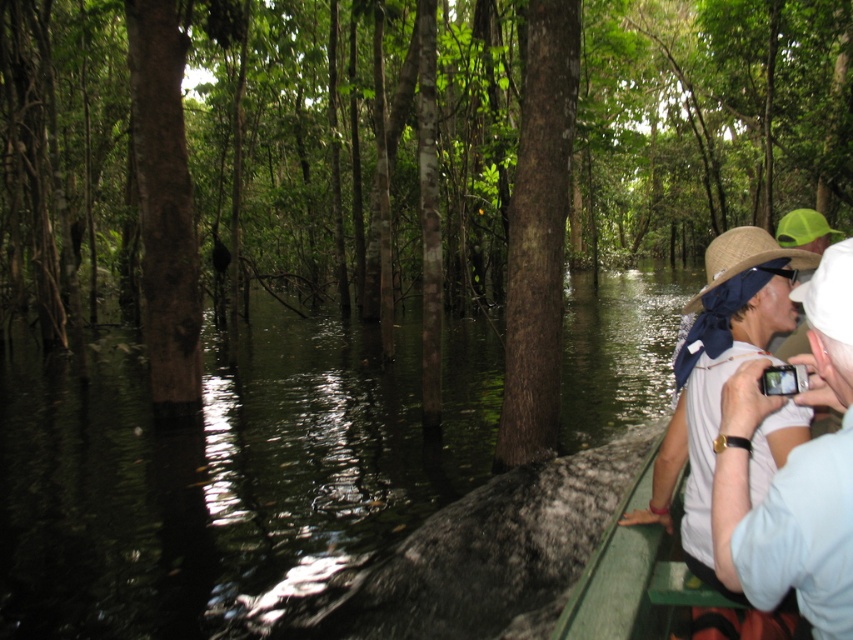
Between light brown straw hat at right and white cotton shirt at right, which one is positioned lower?

Positioned lower is light brown straw hat at right.

Does light brown straw hat at right lie in front of white cotton shirt at right?

Yes, it is in front of white cotton shirt at right.

What do you see at coordinates (793, 472) in the screenshot? I see `light brown straw hat at right` at bounding box center [793, 472].

The image size is (853, 640). What are the coordinates of `light brown straw hat at right` in the screenshot? It's located at (793, 472).

Does brown rough tree at center have a greater width compared to white cotton shirt at right?

Correct, the width of brown rough tree at center exceeds that of white cotton shirt at right.

Is point (498, 81) positioned behind point (699, 538)?

Yes, it is behind point (699, 538).

The width and height of the screenshot is (853, 640). Find the location of `brown rough tree at center`. brown rough tree at center is located at coordinates (402, 157).

Is point (639, 154) positioned behind point (813, 611)?

Yes, point (639, 154) is behind point (813, 611).

Is brown rough tree at center bigger than light brown straw hat at right?

Yes, brown rough tree at center is bigger than light brown straw hat at right.

Does point (566, 77) lie behind point (737, 397)?

Yes, point (566, 77) is farther from viewer.

Locate an element on the screen. This screenshot has width=853, height=640. brown rough tree at center is located at coordinates [402, 157].